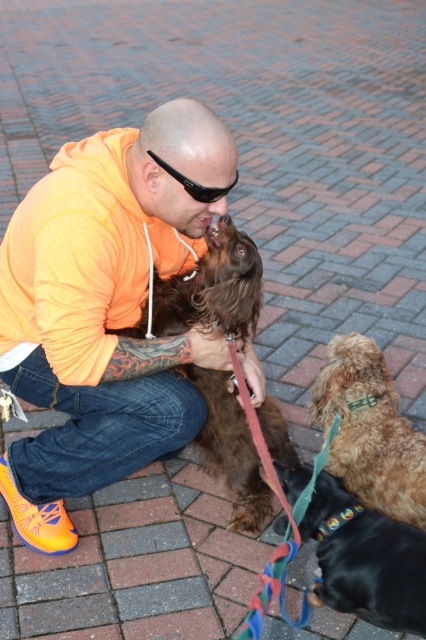
You are a photographer standing in front of the scene. You want to take a picture of the shiny brown fur at lower right and the black plastic sunglasses at upper center. Which object should you focus on first if you want to capture both in one shot without moving the camera?

The shiny brown fur at lower right is located below the black plastic sunglasses at upper center, so you should focus on the black plastic sunglasses at upper center first to ensure both are in focus since it is closer to the camera.

You are standing at the point marked by coordinates point (183, 305) in the image. You want to throw a ball to the smaller dog with curly light brown fur. Can you reach the dog from your current position without moving?

The point (183, 305) is 1.94 meters away from the viewer. Since the smaller dog with curly light brown fur is partially visible in the foreground, it is likely closer than the point, so you can reach the dog without moving.